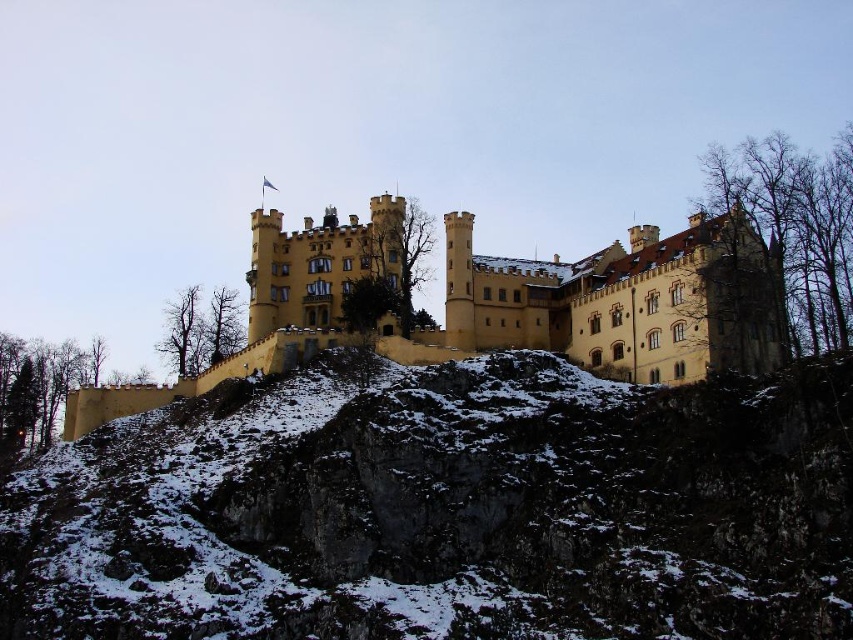
Question: Which of the following is the farthest from the observer?

Choices:
 (A) yellow stone castle at center
 (B) yellow stone wall at center

Answer: (A)

Question: Is yellow stone wall at center closer to camera compared to yellow stone castle at center?

Choices:
 (A) yes
 (B) no

Answer: (A)

Question: Does yellow stone wall at center have a smaller size compared to yellow stone castle at center?

Choices:
 (A) no
 (B) yes

Answer: (B)

Question: Which point is closer to the camera?

Choices:
 (A) (838, 433)
 (B) (683, 300)

Answer: (A)

Question: Which point is farther to the camera?

Choices:
 (A) yellow stone wall at center
 (B) yellow stone castle at center

Answer: (B)

Question: Is yellow stone wall at center thinner than yellow stone castle at center?

Choices:
 (A) no
 (B) yes

Answer: (B)